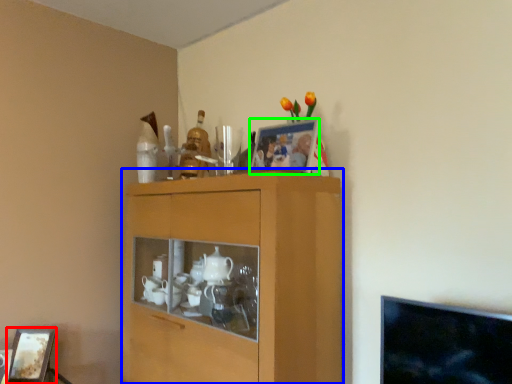
Question: Which object is positioned farthest from picture frame (highlighted by a red box)? Select from cabinetry (highlighted by a blue box) and picture frame (highlighted by a green box).

Choices:
 (A) cabinetry
 (B) picture frame

Answer: (B)